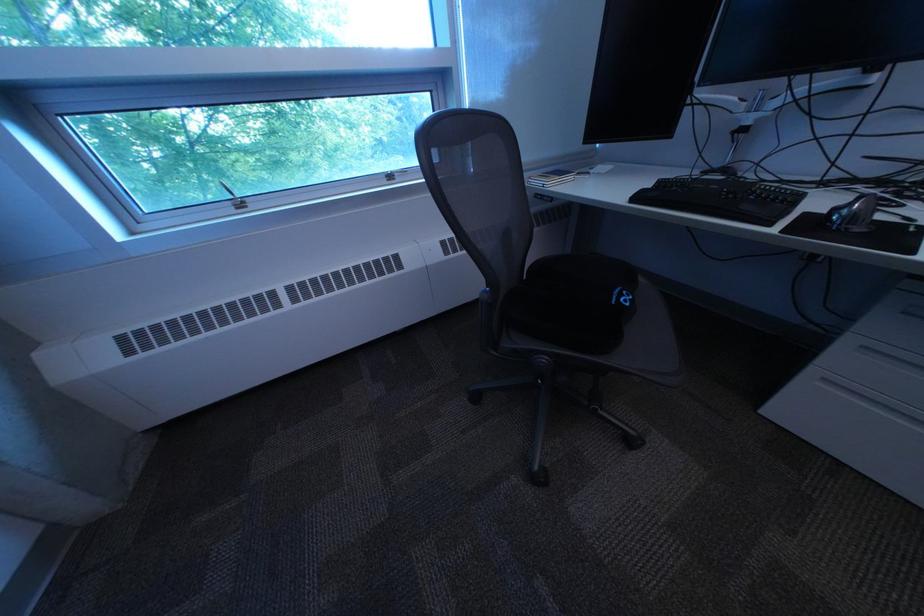
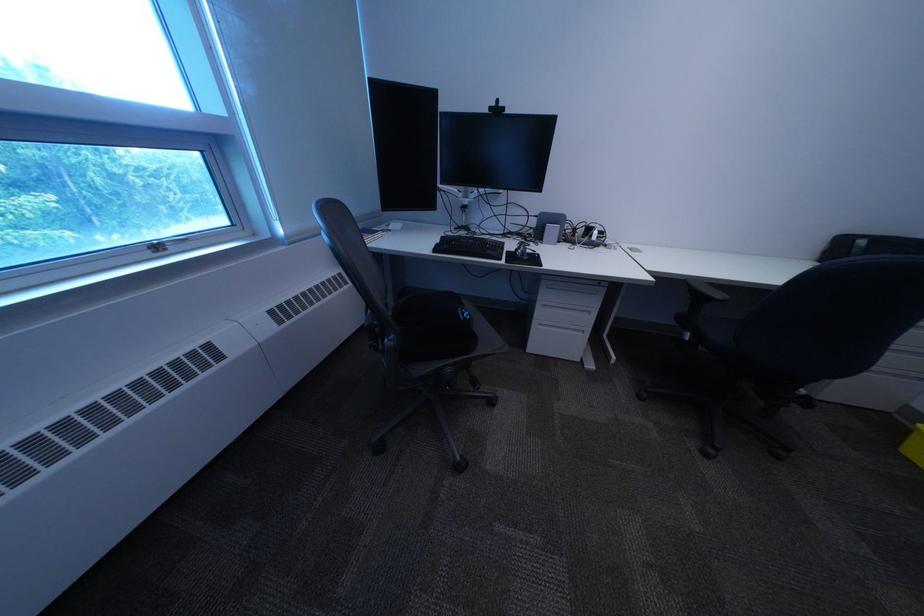
Where in the second image is the point corresponding to (879,349) from the first image?

(558, 307)